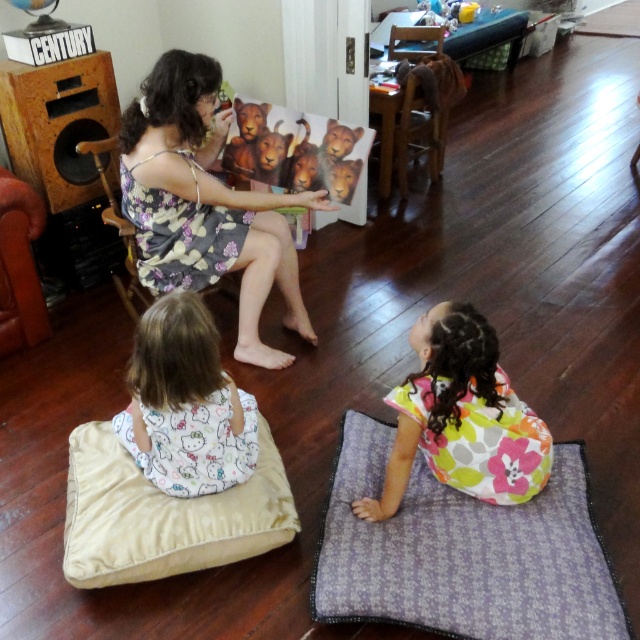
Question: Which object appears farthest from the camera in this image?

Choices:
 (A) purple fabric mat at lower right
 (B) white cotton dress at lower left
 (C) floral dress at upper center

Answer: (C)

Question: Estimate the real-world distances between objects in this image. Which object is farther from the purple fabric mat at lower right?

Choices:
 (A) floral fabric dress at lower right
 (B) floral dress at upper center

Answer: (B)

Question: Is floral dress at upper center closer to the viewer compared to beige fabric pillow at lower left?

Choices:
 (A) yes
 (B) no

Answer: (B)

Question: Is purple fabric mat at lower right bigger than floral fabric dress at lower right?

Choices:
 (A) yes
 (B) no

Answer: (A)

Question: Which point is farther from the camera taking this photo?

Choices:
 (A) (248, 474)
 (B) (467, 420)
 (C) (486, 600)
 (D) (65, 528)

Answer: (A)

Question: Does floral fabric dress at lower right have a lesser width compared to white cotton dress at lower left?

Choices:
 (A) no
 (B) yes

Answer: (A)